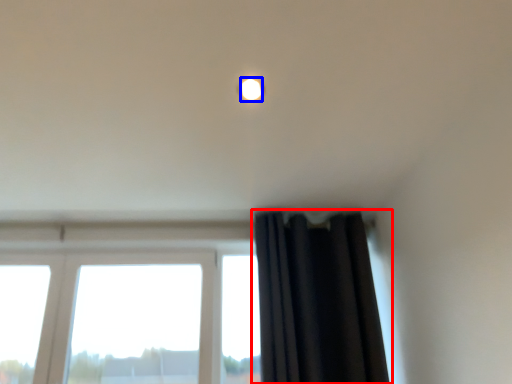
Question: Which object is further to the camera taking this photo, curtain (highlighted by a red box) or lighting (highlighted by a blue box)?

Choices:
 (A) curtain
 (B) lighting

Answer: (A)